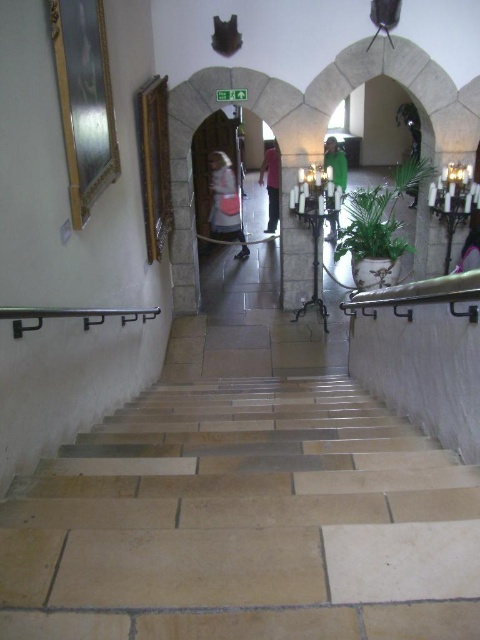
Can you confirm if light brown stone stairs at center is positioned below pink fabric dress at lower right?

Correct, light brown stone stairs at center is located below pink fabric dress at lower right.

Is point (64, 552) positioned in front of point (463, 268)?

Yes.

This screenshot has height=640, width=480. What do you see at coordinates (244, 522) in the screenshot?
I see `light brown stone stairs at center` at bounding box center [244, 522].

Find the location of `light brown stone stairs at center`. light brown stone stairs at center is located at coordinates (244, 522).

Measure the distance between point (252, 566) and camera.

4.53 feet

Describe the element at coordinates (244, 522) in the screenshot. This screenshot has width=480, height=640. I see `light brown stone stairs at center` at that location.

Identify the location of light brown stone stairs at center. The image size is (480, 640). (244, 522).

In the scene shown: Which is below, light brown leather jacket at center or pink fabric dress at lower right?

pink fabric dress at lower right is lower down.

Is light brown leather jacket at center smaller than pink fabric dress at lower right?

Incorrect, light brown leather jacket at center is not smaller in size than pink fabric dress at lower right.

Describe the element at coordinates (226, 202) in the screenshot. I see `light brown leather jacket at center` at that location.

What are the coordinates of `light brown leather jacket at center` in the screenshot? It's located at (226, 202).